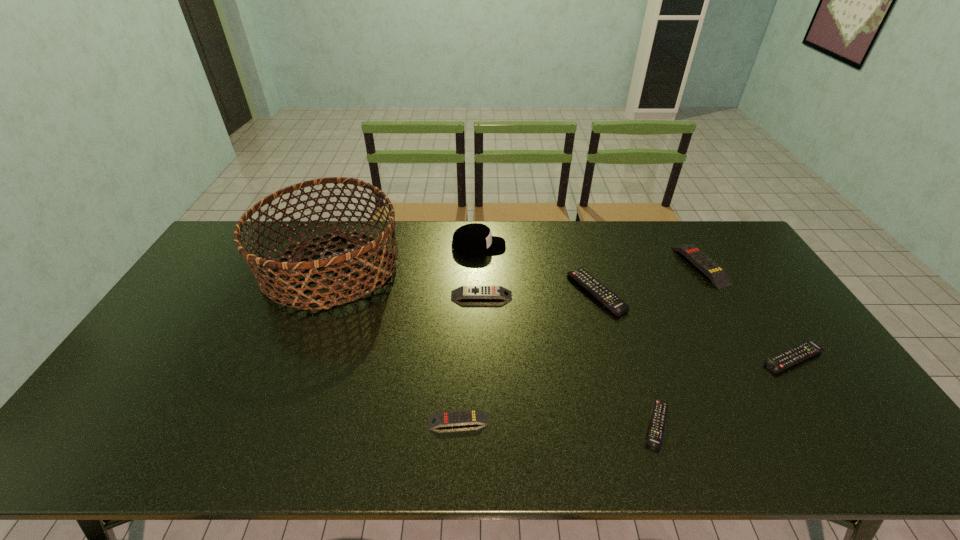
Identify the location of the smallest yellow remote control. (465, 417).

I want to click on the nearest black remote control, so click(x=658, y=418).

The width and height of the screenshot is (960, 540). In order to click on the smallest black remote control in this screenshot , I will do click(658, 418).

This screenshot has height=540, width=960. What are the coordinates of `vacant region located 0.060m on the front of the tallest object` in the screenshot? It's located at (305, 332).

Find the location of a particular element. This screenshot has height=540, width=960. vacant space located on the front-facing side of the second tallest object is located at coordinates (550, 246).

Where is `vacant space located on the right of the sixth shortest object`? vacant space located on the right of the sixth shortest object is located at coordinates (754, 266).

The width and height of the screenshot is (960, 540). Identify the location of free space located 0.320m on the front of the second nearest yellow remote control. (482, 387).

What are the coordinates of `blank area located 0.090m on the back of the farthest black remote control` in the screenshot? It's located at (x=585, y=254).

At what (x,y) coordinates should I click in order to perform the action: click on vacant point located 0.250m on the back of the fourth farthest remote control. Please return your answer as a coordinate pair (x, y). The height and width of the screenshot is (540, 960). Looking at the image, I should click on (743, 284).

Where is `free space located on the right of the smallest yellow remote control`? This screenshot has height=540, width=960. free space located on the right of the smallest yellow remote control is located at coordinates [517, 421].